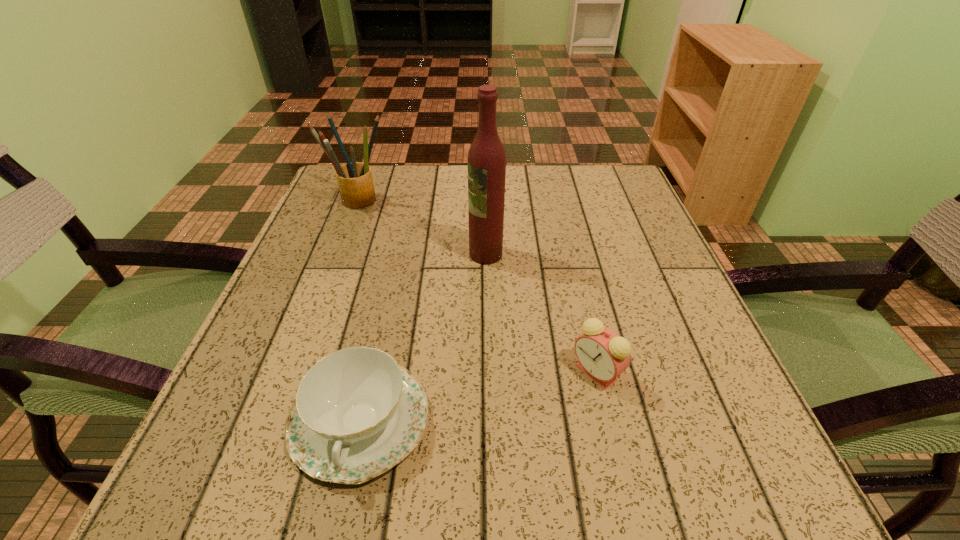
Locate an element on the screen. liquor is located at coordinates (486, 161).

Find the location of a particular element. Image resolution: width=960 pixels, height=540 pixels. the third nearest object is located at coordinates (486, 161).

Where is `the farthest object`? This screenshot has height=540, width=960. the farthest object is located at coordinates (354, 179).

Find the location of a particular element. pencil box is located at coordinates (354, 179).

Find the location of a particular element. the second shortest object is located at coordinates (603, 355).

The image size is (960, 540). I want to click on the rightmost object, so click(x=603, y=355).

The width and height of the screenshot is (960, 540). In order to click on the shortest object in this screenshot , I will do `click(357, 414)`.

Locate an element on the screen. Image resolution: width=960 pixels, height=540 pixels. blank area located 0.330m on the label of the second farthest object is located at coordinates (303, 254).

You are a GUI agent. You are given a task and a screenshot of the screen. Output one action in this format:
    pyautogui.click(x=<x>, y=<y>)
    Task: Click on the vacant area located 0.120m on the label of the second farthest object
    This screenshot has width=960, height=540.
    Given the screenshot: What is the action you would take?
    pyautogui.click(x=409, y=254)

Image resolution: width=960 pixels, height=540 pixels. I want to click on vacant space situated 0.170m on the label of the second farthest object, so click(384, 254).